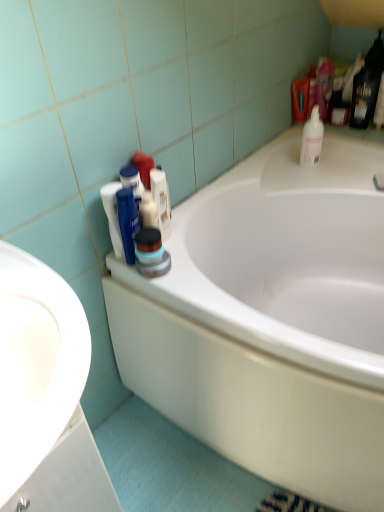
The image size is (384, 512). I want to click on free location to the right of matte black container at center, arranged as the second cleaning product when viewed from the right, so click(189, 275).